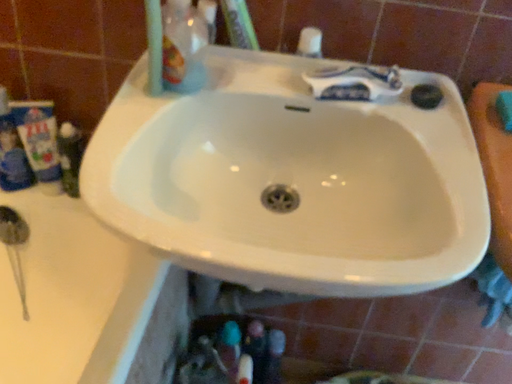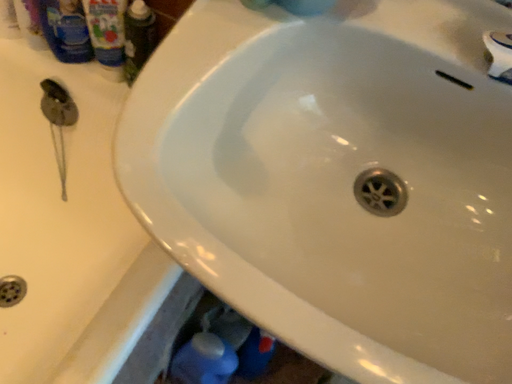
Question: Which way did the camera rotate in the video?

Choices:
 (A) rotated upward
 (B) rotated downward

Answer: (B)